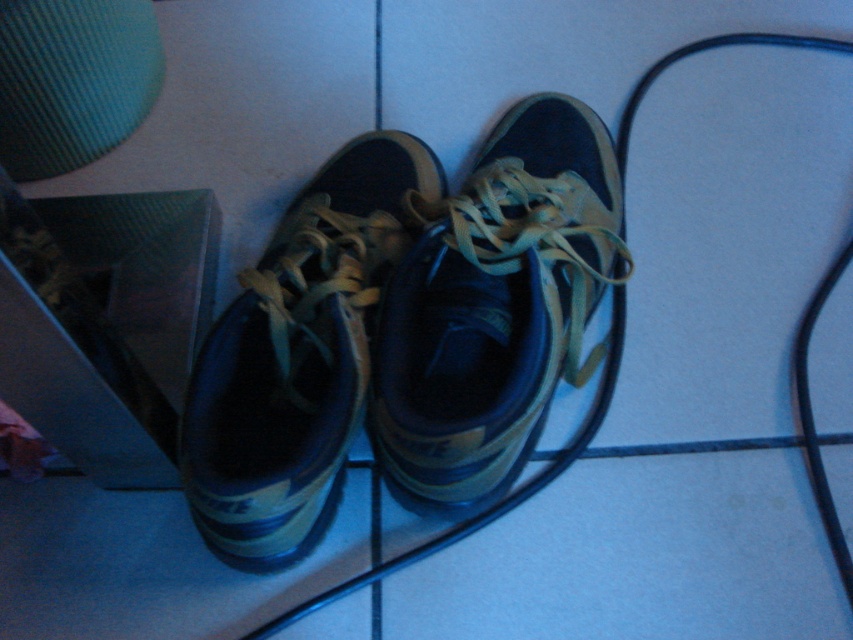
Identify the location of matte black sneaker at center. Image resolution: width=853 pixels, height=640 pixels. (496, 305).

Locate an element on the screen. The height and width of the screenshot is (640, 853). matte black sneaker at center is located at coordinates (496, 305).